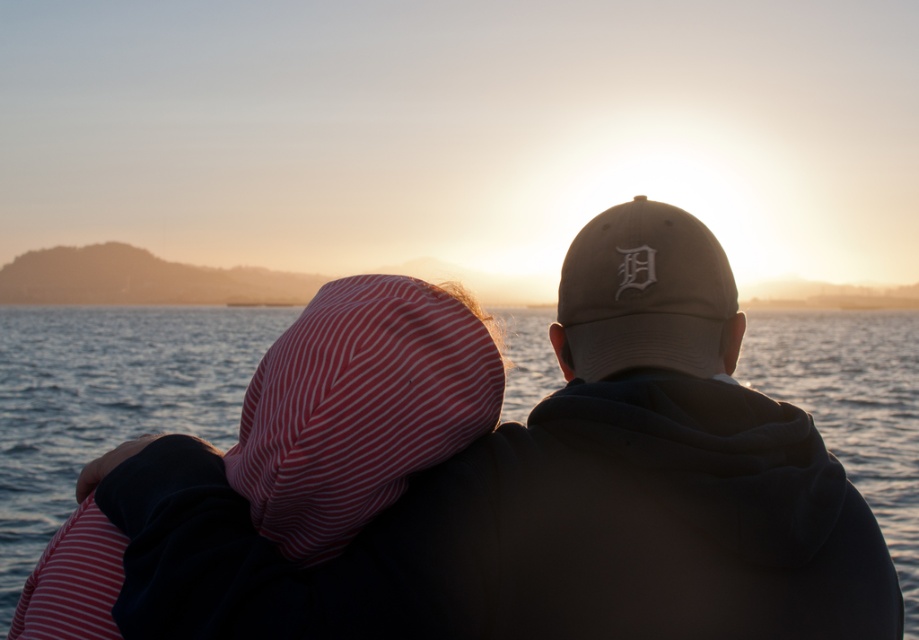
Question: Is khaki fabric cap at upper right to the left of blue water at center from the viewer's perspective?

Choices:
 (A) no
 (B) yes

Answer: (A)

Question: Does khaki fabric cap at upper right appear under blue water at center?

Choices:
 (A) yes
 (B) no

Answer: (B)

Question: Does khaki fabric cap at upper right appear over blue water at center?

Choices:
 (A) yes
 (B) no

Answer: (A)

Question: Among these points, which one is farthest from the camera?

Choices:
 (A) (813, 616)
 (B) (213, 400)

Answer: (B)

Question: Among these objects, which one is nearest to the camera?

Choices:
 (A) blue water at center
 (B) khaki fabric cap at upper right

Answer: (B)